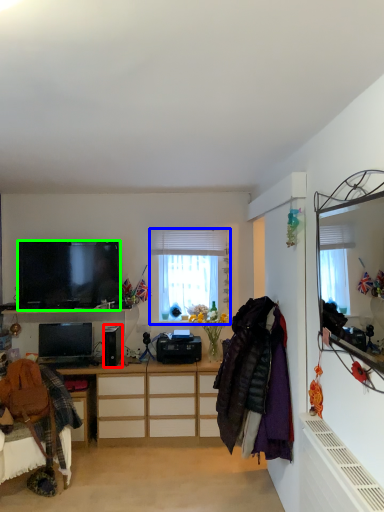
Question: Which is farther away from speaker (highlighted by a red box)? window (highlighted by a blue box) or television (highlighted by a green box)?

Choices:
 (A) window
 (B) television

Answer: (A)